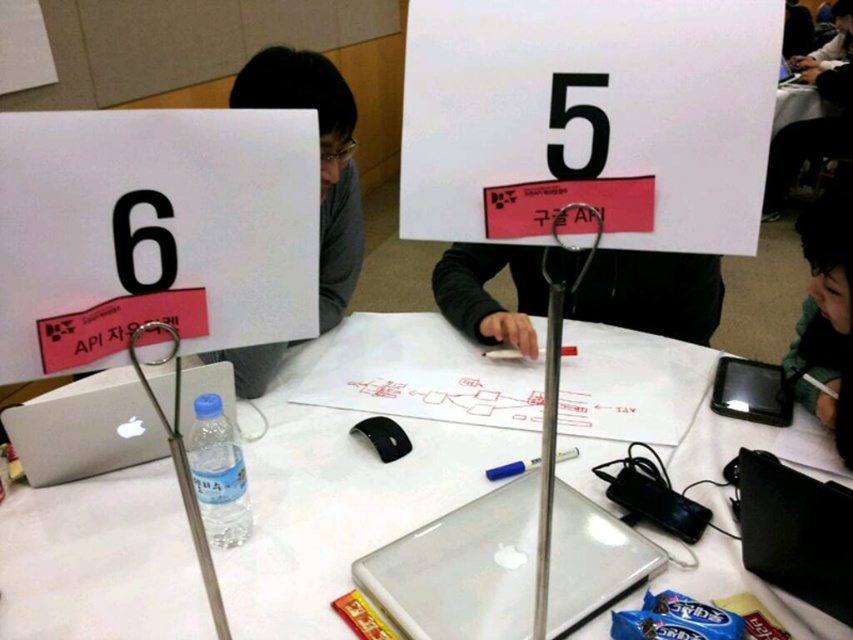
Does matte gray shirt at center appear over black glossy laptop at lower right?

Indeed, matte gray shirt at center is positioned over black glossy laptop at lower right.

Is matte gray shirt at center thinner than black glossy laptop at lower right?

Incorrect, matte gray shirt at center's width is not less than black glossy laptop at lower right's.

Identify the location of matte gray shirt at center. This screenshot has width=853, height=640. (318, 157).

Is silver metallic laptop at center bigger than sleek silver laptop at lower left?

Incorrect, silver metallic laptop at center is not larger than sleek silver laptop at lower left.

Who is more distant from viewer, [392,618] or [22,419]?

The point [22,419] is more distant.

Identify the location of silver metallic laptop at center. The width and height of the screenshot is (853, 640). (462, 570).

Is point (512, 476) positioned after point (541, 352)?

No, (512, 476) is in front of (541, 352).

Who is taller, blue glossy pen at center or blue matte pen at center?

With more height is blue glossy pen at center.

Describe the element at coordinates (511, 468) in the screenshot. I see `blue glossy pen at center` at that location.

Find the location of `blue glossy pen at center`. blue glossy pen at center is located at coordinates (511, 468).